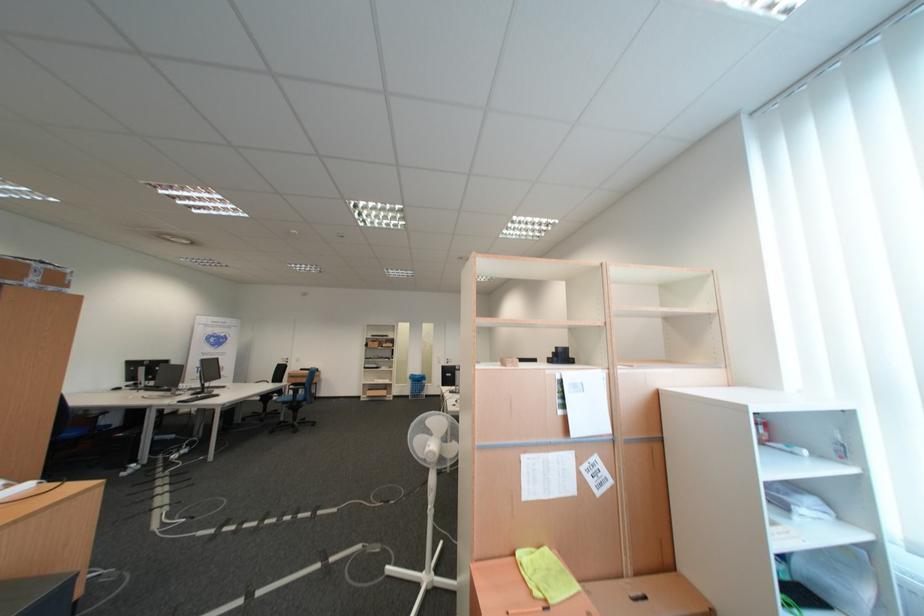
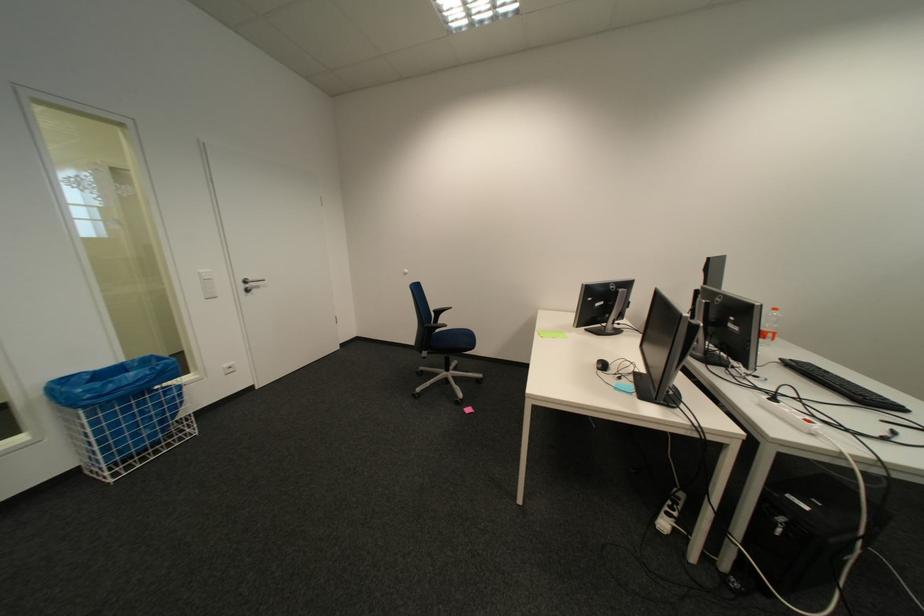
In the second image, find the point that corresponds to point 458,362 in the first image.

(254, 286)